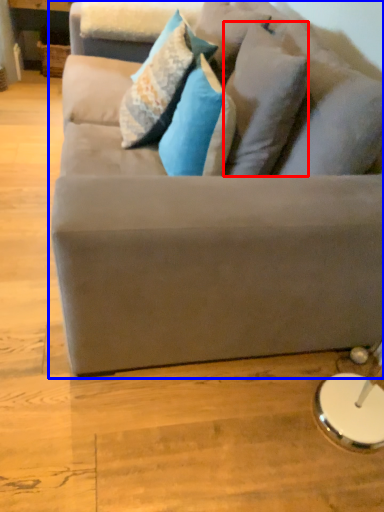
Question: Which object appears farthest to the camera in this image, pillow (highlighted by a red box) or studio couch (highlighted by a blue box)?

Choices:
 (A) pillow
 (B) studio couch

Answer: (A)